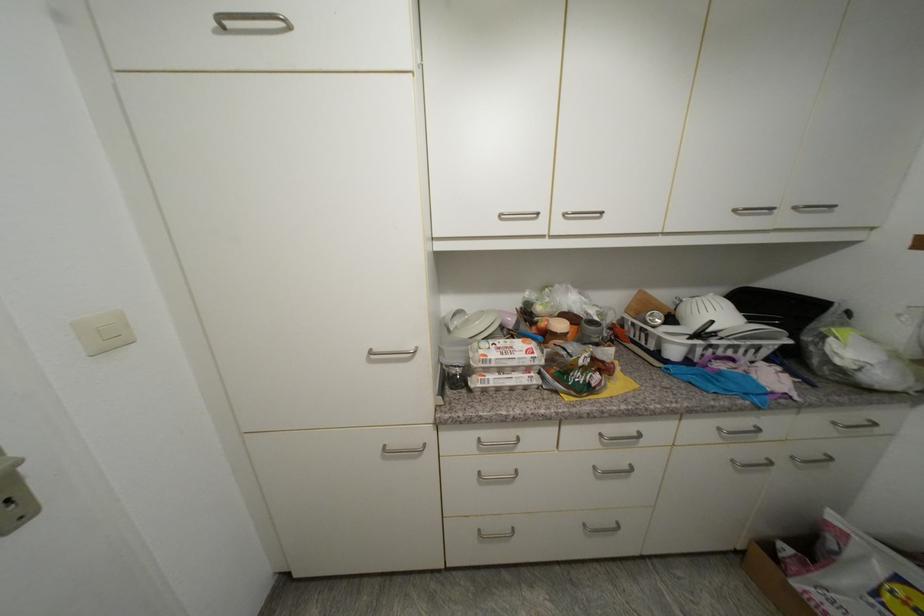
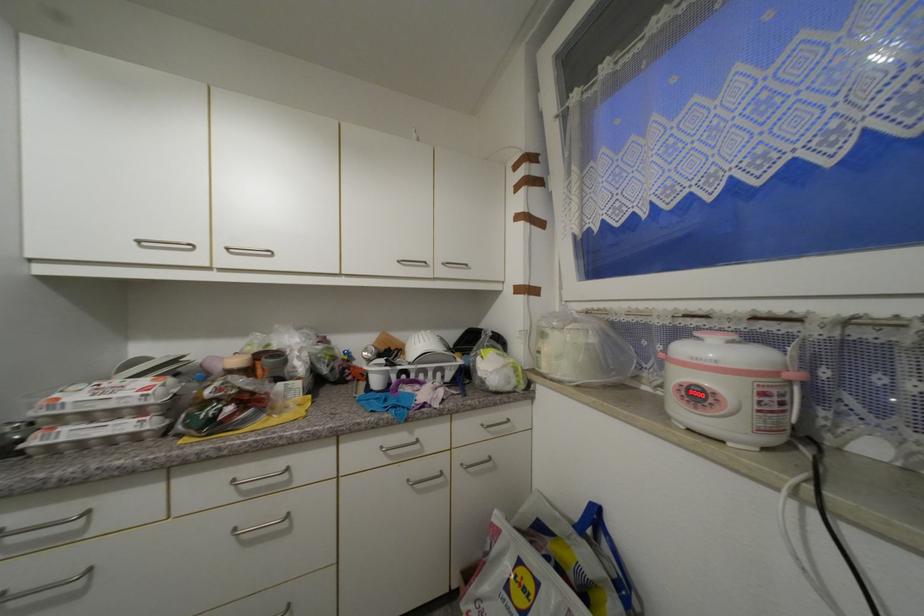
The point at (840, 424) is marked in the first image. Where is the corresponding point in the second image?

(488, 427)